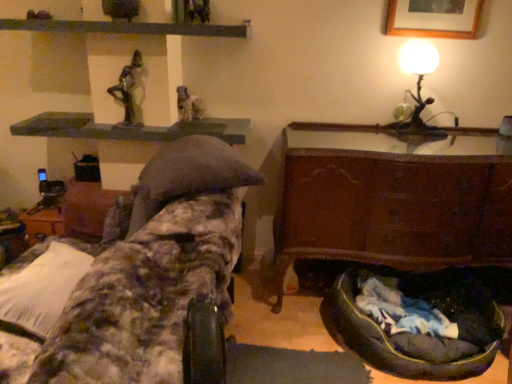
Image resolution: width=512 pixels, height=384 pixels. Describe the element at coordinates (127, 91) in the screenshot. I see `green metallic statue at upper center, arranged as the first sculpture when viewed from the front` at that location.

Where is `wooden picture frame at upper right`? wooden picture frame at upper right is located at coordinates (434, 18).

The image size is (512, 384). Identify the location of green metallic statue at upper center, which is the second sculpture from back to front. (127, 91).

Considering the sizes of green metallic statue at upper center, arranged as the first sculpture when viewed from the front, and green matte shelf at upper center, which is the 1th shelf in top-to-bottom order, in the image, is green metallic statue at upper center, arranged as the first sculpture when viewed from the front, bigger or smaller than green matte shelf at upper center, which is the 1th shelf in top-to-bottom order,?

Clearly, green metallic statue at upper center, arranged as the first sculpture when viewed from the front, is smaller in size than green matte shelf at upper center, which is the 1th shelf in top-to-bottom order.

Would you say green metallic statue at upper center, the 1th sculpture from the left, is inside or outside green matte shelf at upper center, the second shelf in the bottom-to-top sequence?

green metallic statue at upper center, the 1th sculpture from the left, lies outside green matte shelf at upper center, the second shelf in the bottom-to-top sequence.

Which point is more forward, (136, 60) or (236, 30)?

The point (236, 30) is closer to the camera.

Does green metallic statue at upper center, the second sculpture when ordered from right to left, lie behind green matte shelf at upper center, the second shelf in the bottom-to-top sequence?

Yes, green metallic statue at upper center, the second sculpture when ordered from right to left, is further from the camera.

From the image's perspective, does camouflage fabric bedroll at left, the 2th furniture positioned from the right, appear higher than green metallic statue at upper center, the 1th sculpture from the left?

No.

Can green metallic statue at upper center, which is the second sculpture from back to front, be found inside camouflage fabric bedroll at left, which is the 1th furniture in left-to-right order?

No, green metallic statue at upper center, which is the second sculpture from back to front, is not surrounded by camouflage fabric bedroll at left, which is the 1th furniture in left-to-right order.

Does camouflage fabric bedroll at left, which is the 1th furniture in left-to-right order, appear on the left side of green metallic statue at upper center, the 1th sculpture from the left?

In fact, camouflage fabric bedroll at left, which is the 1th furniture in left-to-right order, is to the right of green metallic statue at upper center, the 1th sculpture from the left.

Are camouflage fabric bedroll at left, the 2th furniture positioned from the right, and green metallic statue at upper center, arranged as the first sculpture when viewed from the front, beside each other?

No, camouflage fabric bedroll at left, the 2th furniture positioned from the right, is not touching green metallic statue at upper center, arranged as the first sculpture when viewed from the front.

Considering the relative sizes of green metallic statue at upper center, the second sculpture when ordered from right to left, and metallic matte table lamp at upper right in the image provided, is green metallic statue at upper center, the second sculpture when ordered from right to left, thinner than metallic matte table lamp at upper right?

Yes, green metallic statue at upper center, the second sculpture when ordered from right to left, is thinner than metallic matte table lamp at upper right.

Which is in front, green metallic statue at upper center, arranged as the first sculpture when viewed from the front, or metallic matte table lamp at upper right?

green metallic statue at upper center, arranged as the first sculpture when viewed from the front.

Considering the positions of objects green metallic statue at upper center, the 1th sculpture from the left, and metallic matte table lamp at upper right in the image provided, who is more to the left, green metallic statue at upper center, the 1th sculpture from the left, or metallic matte table lamp at upper right?

green metallic statue at upper center, the 1th sculpture from the left, is more to the left.

Could you tell me if green metallic statue at upper center, which is the second sculpture from back to front, is turned towards metallic matte table lamp at upper right?

No, green metallic statue at upper center, which is the second sculpture from back to front, does not turn towards metallic matte table lamp at upper right.

Can you tell me how much green matte shelf at upper center, which is the 1th shelf in top-to-bottom order, and green concrete shelf at upper center, placed as the 2th shelf when sorted from top to bottom, differ in facing direction?

They differ by 0.000659 degrees in their facing directions.

You are a GUI agent. You are given a task and a screenshot of the screen. Output one action in this format:
    pyautogui.click(x=<x>, y=<y>)
    Task: Click on the shelf located above the green concrete shelf at upper center, placed as the 2th shelf when sorted from top to bottom (from the image's perspective)
    Image resolution: width=512 pixels, height=384 pixels.
    Given the screenshot: What is the action you would take?
    pyautogui.click(x=127, y=27)

Which is more to the right, green matte shelf at upper center, which is the 1th shelf in top-to-bottom order, or green concrete shelf at upper center, placed as the 2th shelf when sorted from top to bottom?

Positioned to the right is green matte shelf at upper center, which is the 1th shelf in top-to-bottom order.

Consider the image. Is green matte shelf at upper center, the second shelf in the bottom-to-top sequence, outside of green concrete shelf at upper center, the first shelf from the bottom?

Indeed, green matte shelf at upper center, the second shelf in the bottom-to-top sequence, is completely outside green concrete shelf at upper center, the first shelf from the bottom.

Which object is positioned more to the left, green metallic statue at upper center, the second sculpture when ordered from right to left, or matte stone statue at upper center, the first sculpture positioned from the right?

Positioned to the left is green metallic statue at upper center, the second sculpture when ordered from right to left.

Is green metallic statue at upper center, which is the second sculpture from back to front, directly adjacent to matte stone statue at upper center, arranged as the 2th sculpture when viewed from the left?

No, green metallic statue at upper center, which is the second sculpture from back to front, is not beside matte stone statue at upper center, arranged as the 2th sculpture when viewed from the left.

Find the location of a particular element. Image resolution: width=512 pixels, height=384 pixels. sculpture on the left of the matte stone statue at upper center, the first sculpture positioned from the right is located at coordinates (127, 91).

Who is smaller, green metallic statue at upper center, the second sculpture when ordered from right to left, or matte stone statue at upper center, the first sculpture positioned from the right?

matte stone statue at upper center, the first sculpture positioned from the right, is smaller.

From a real-world perspective, is green matte shelf at upper center, which is the 1th shelf in top-to-bottom order, located higher than matte stone statue at upper center, arranged as the 2th sculpture when viewed from the left?

Yes, from a real-world perspective, green matte shelf at upper center, which is the 1th shelf in top-to-bottom order, is on top of matte stone statue at upper center, arranged as the 2th sculpture when viewed from the left.

From the image's perspective, does green matte shelf at upper center, the second shelf in the bottom-to-top sequence, appear lower than matte stone statue at upper center, arranged as the 2th sculpture when viewed from the left?

No, from the image's perspective, green matte shelf at upper center, the second shelf in the bottom-to-top sequence, is not beneath matte stone statue at upper center, arranged as the 2th sculpture when viewed from the left.

Relative to matte stone statue at upper center, positioned as the 1th sculpture in back-to-front order, is green matte shelf at upper center, which is the 1th shelf in top-to-bottom order, in front or behind?

In the image, green matte shelf at upper center, which is the 1th shelf in top-to-bottom order, appears in front of matte stone statue at upper center, positioned as the 1th sculpture in back-to-front order.

Between metallic matte table lamp at upper right and dark gray fabric bean bag at lower right, which one has smaller width?

metallic matte table lamp at upper right is thinner.

Looking at the image, does metallic matte table lamp at upper right seem bigger or smaller compared to dark gray fabric bean bag at lower right?

metallic matte table lamp at upper right is smaller than dark gray fabric bean bag at lower right.

Where is `table lamp behind the dark gray fabric bean bag at lower right`? The width and height of the screenshot is (512, 384). table lamp behind the dark gray fabric bean bag at lower right is located at coordinates (418, 84).

Is metallic matte table lamp at upper right closer to camera compared to dark gray fabric bean bag at lower right?

No, metallic matte table lamp at upper right is behind dark gray fabric bean bag at lower right.

Which sculpture is the 1st one when counting from the back of the green matte shelf at upper center, the second shelf in the bottom-to-top sequence? Please provide its 2D coordinates.

[(127, 91)]

Where is `the 1st furniture to the right of the green metallic statue at upper center, arranged as the first sculpture when viewed from the front, starting your count from the anchor`? This screenshot has height=384, width=512. the 1st furniture to the right of the green metallic statue at upper center, arranged as the first sculpture when viewed from the front, starting your count from the anchor is located at coordinates (154, 271).

Based on their spatial positions, is camouflage fabric bedroll at left, the 2th furniture positioned from the right, or green metallic statue at upper center, the second sculpture when ordered from right to left, further from green matte shelf at upper center, which is the 1th shelf in top-to-bottom order?

camouflage fabric bedroll at left, the 2th furniture positioned from the right, is further to green matte shelf at upper center, which is the 1th shelf in top-to-bottom order.

Considering their positions, is green matte shelf at upper center, which is the 1th shelf in top-to-bottom order, positioned further to matte stone statue at upper center, the first sculpture positioned from the right, than green metallic statue at upper center, which is the second sculpture from back to front?

green matte shelf at upper center, which is the 1th shelf in top-to-bottom order, is positioned further to the anchor matte stone statue at upper center, the first sculpture positioned from the right.

Which object lies further to the anchor point green matte shelf at upper center, the second shelf in the bottom-to-top sequence, green metallic statue at upper center, the second sculpture when ordered from right to left, or matte stone statue at upper center, marked as the 2th sculpture in a front-to-back arrangement?

The object further to green matte shelf at upper center, the second shelf in the bottom-to-top sequence, is matte stone statue at upper center, marked as the 2th sculpture in a front-to-back arrangement.

Estimate the real-world distances between objects in this image. Which object is further from matte stone statue at upper center, marked as the 2th sculpture in a front-to-back arrangement, camouflage fabric bedroll at left, the 2th furniture positioned from the right, or metallic matte table lamp at upper right?

The object further to matte stone statue at upper center, marked as the 2th sculpture in a front-to-back arrangement, is metallic matte table lamp at upper right.

From the image, which object appears to be farther from wooden picture frame at upper right, dark gray fabric bean bag at lower right or metallic matte table lamp at upper right?

dark gray fabric bean bag at lower right is further to wooden picture frame at upper right.

When comparing their distances from green concrete shelf at upper center, placed as the 2th shelf when sorted from top to bottom, does dark gray fabric bean bag at lower right or rustic wood chest at lower right, positioned as the 2th furniture in left-to-right order, seem closer?

rustic wood chest at lower right, positioned as the 2th furniture in left-to-right order, lies closer to green concrete shelf at upper center, placed as the 2th shelf when sorted from top to bottom, than the other object.

Considering their positions, is rustic wood chest at lower right, positioned as the 2th furniture in left-to-right order, positioned closer to wooden picture frame at upper right than dark gray fabric bean bag at lower right?

rustic wood chest at lower right, positioned as the 2th furniture in left-to-right order.

From the image, which object appears to be farther from green metallic statue at upper center, which is the second sculpture from back to front, rustic wood chest at lower right, positioned as the 2th furniture in left-to-right order, or green matte shelf at upper center, which is the 1th shelf in top-to-bottom order?

Among the two, rustic wood chest at lower right, positioned as the 2th furniture in left-to-right order, is located further to green metallic statue at upper center, which is the second sculpture from back to front.

I want to click on picture frame between camouflage fabric bedroll at left, which is the 1th furniture in left-to-right order, and matte stone statue at upper center, arranged as the 2th sculpture when viewed from the left, along the z-axis, so click(434, 18).

You are a GUI agent. You are given a task and a screenshot of the screen. Output one action in this format:
    pyautogui.click(x=<x>, y=<y>)
    Task: Click on the furniture situated between matte stone statue at upper center, marked as the 2th sculpture in a front-to-back arrangement, and dark gray fabric bean bag at lower right from left to right
    This screenshot has width=512, height=384.
    Given the screenshot: What is the action you would take?
    pyautogui.click(x=393, y=198)

You are a GUI agent. You are given a task and a screenshot of the screen. Output one action in this format:
    pyautogui.click(x=<x>, y=<y>)
    Task: Click on the sculpture located between camouflage fabric bedroll at left, which is the 1th furniture in left-to-right order, and matte stone statue at upper center, positioned as the 1th sculpture in back-to-front order, in the depth direction
    This screenshot has width=512, height=384.
    Given the screenshot: What is the action you would take?
    pyautogui.click(x=127, y=91)

You are a GUI agent. You are given a task and a screenshot of the screen. Output one action in this format:
    pyautogui.click(x=<x>, y=<y>)
    Task: Click on the bean bag chair situated between green metallic statue at upper center, the second sculpture when ordered from right to left, and metallic matte table lamp at upper right from left to right
    This screenshot has height=384, width=512.
    Given the screenshot: What is the action you would take?
    pyautogui.click(x=422, y=334)